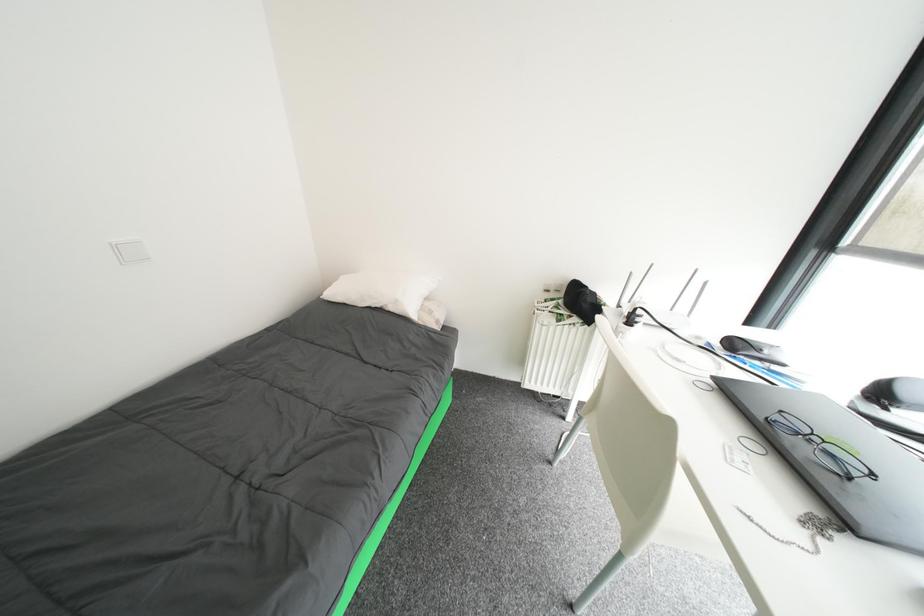
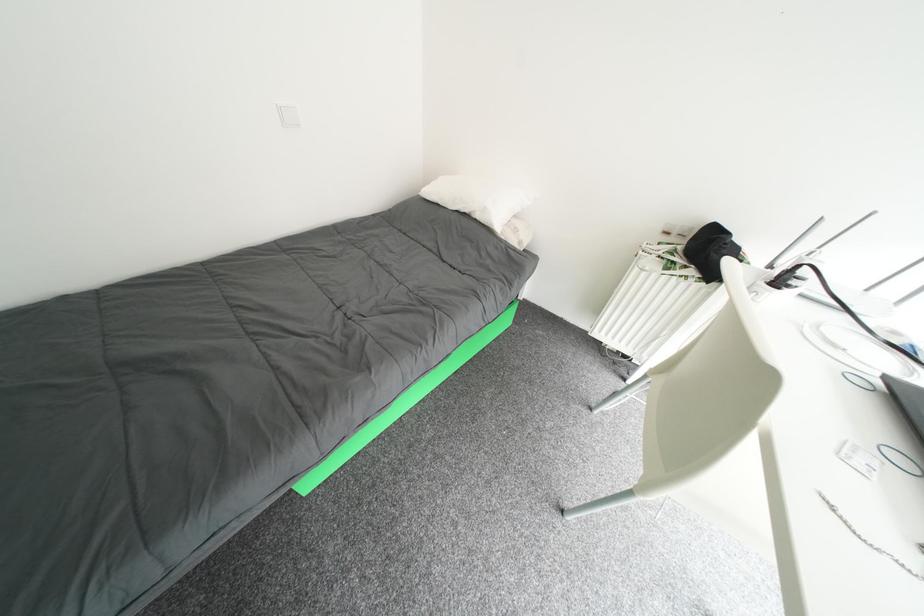
Question: The images are taken continuously from a first-person perspective. In which direction are you moving?

Choices:
 (A) Left
 (B) Right
 (C) Forward
 (D) Backward

Answer: (B)